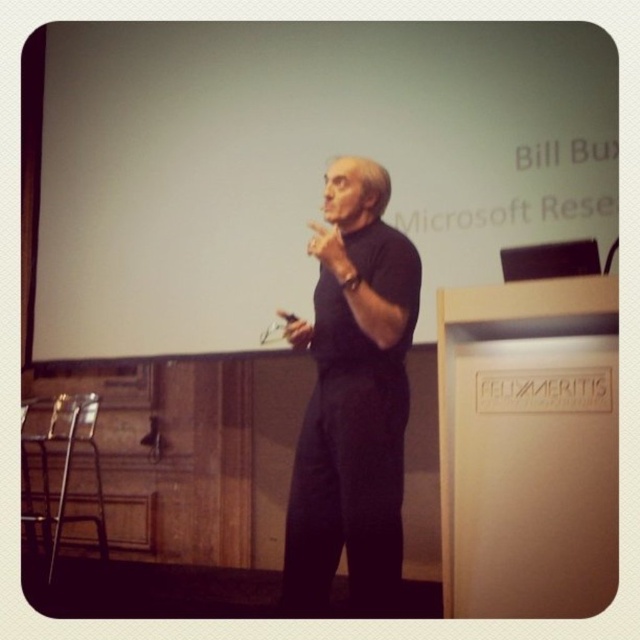
Consider the image. Does white matte projection screen at upper left have a greater height compared to black matte shirt at center?

Indeed, white matte projection screen at upper left has a greater height compared to black matte shirt at center.

Based on the photo, between white matte projection screen at upper left and black matte shirt at center, which one is positioned higher?

Positioned higher is white matte projection screen at upper left.

The height and width of the screenshot is (640, 640). What are the coordinates of `white matte projection screen at upper left` in the screenshot? It's located at (300, 163).